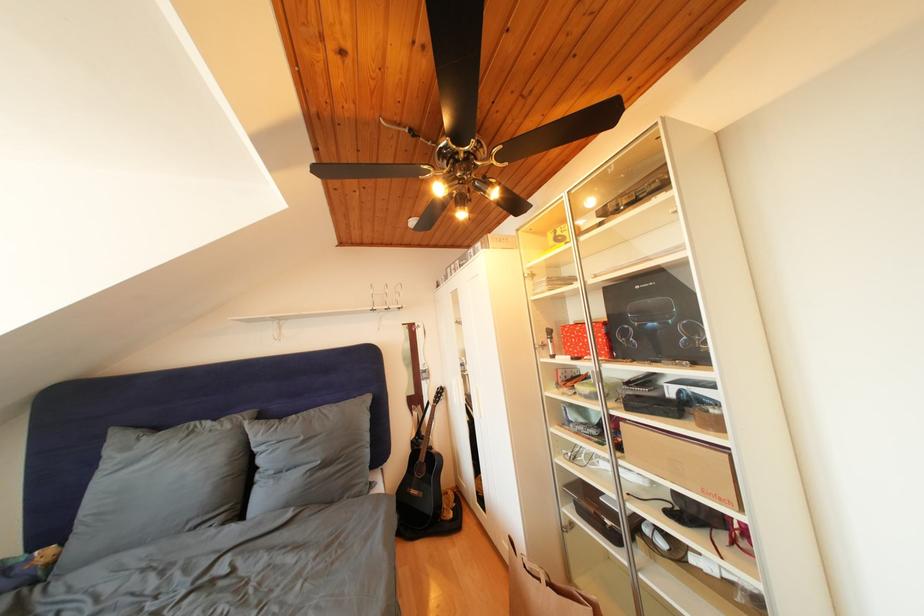
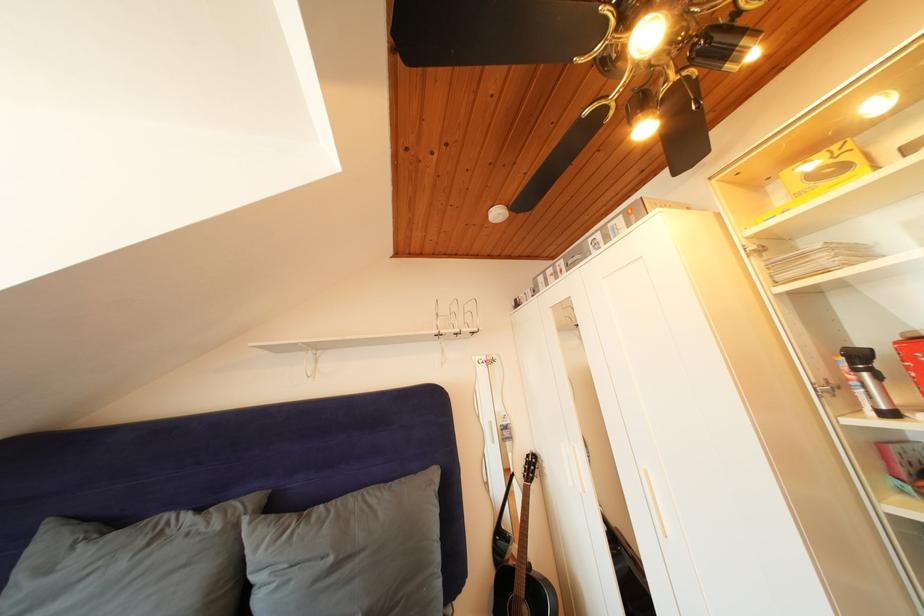
Locate, in the second image, the point that corresponds to (236,432) in the first image.

(225, 531)